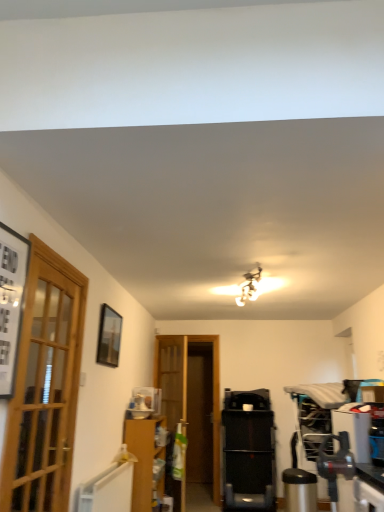
Question: From the image's perspective, is black plastic treadmill at center located above brown cardboard cabinet at lower left?

Choices:
 (A) yes
 (B) no

Answer: (B)

Question: From the image's perspective, is black plastic treadmill at center below brown cardboard cabinet at lower left?

Choices:
 (A) yes
 (B) no

Answer: (A)

Question: Is black plastic treadmill at center taller than brown cardboard cabinet at lower left?

Choices:
 (A) no
 (B) yes

Answer: (B)

Question: Is black plastic treadmill at center turned away from brown cardboard cabinet at lower left?

Choices:
 (A) yes
 (B) no

Answer: (B)

Question: Is black plastic treadmill at center aimed at brown cardboard cabinet at lower left?

Choices:
 (A) yes
 (B) no

Answer: (B)

Question: From a real-world perspective, does black plastic treadmill at center stand above brown cardboard cabinet at lower left?

Choices:
 (A) no
 (B) yes

Answer: (B)

Question: Can you confirm if wooden door at center, placed as the first door when sorted from back to front, is shorter than brown cardboard cabinet at lower left?

Choices:
 (A) yes
 (B) no

Answer: (B)

Question: From a real-world perspective, is wooden door at center, placed as the first door when sorted from back to front, physically below brown cardboard cabinet at lower left?

Choices:
 (A) yes
 (B) no

Answer: (B)

Question: Is wooden door at center, the 1th door in the right-to-left sequence, wider than brown cardboard cabinet at lower left?

Choices:
 (A) yes
 (B) no

Answer: (B)

Question: Is wooden door at center, marked as the second door in a front-to-back arrangement, turned away from brown cardboard cabinet at lower left?

Choices:
 (A) no
 (B) yes

Answer: (A)

Question: Can you confirm if wooden door at center, the 1th door in the right-to-left sequence, is bigger than brown cardboard cabinet at lower left?

Choices:
 (A) yes
 (B) no

Answer: (B)

Question: Considering the relative positions of wooden door at center, the 2th door from the left, and brown cardboard cabinet at lower left in the image provided, is wooden door at center, the 2th door from the left, in front of brown cardboard cabinet at lower left?

Choices:
 (A) no
 (B) yes

Answer: (A)

Question: Is black plastic treadmill at center oriented towards matte black picture frame at upper left, which is the 2th picture frame in left-to-right order?

Choices:
 (A) yes
 (B) no

Answer: (B)